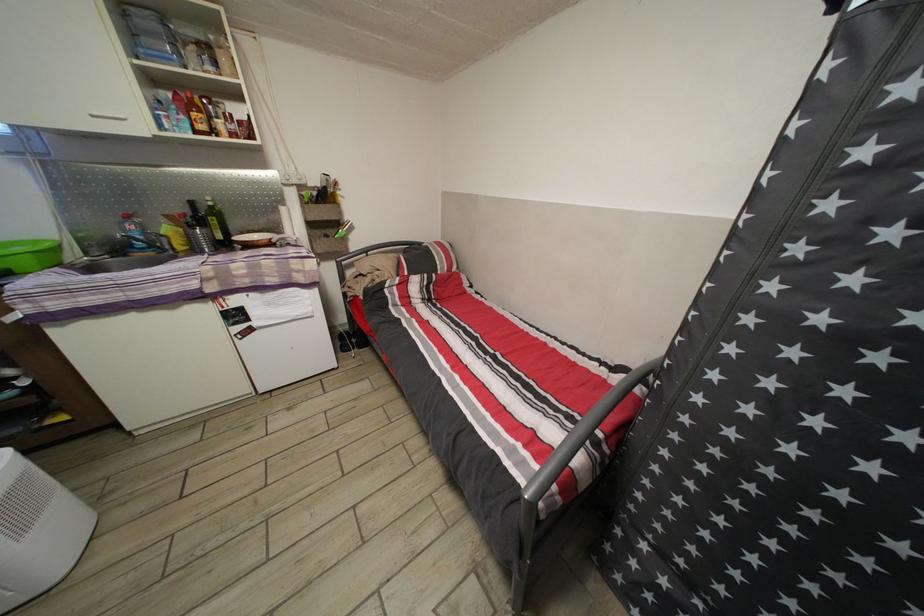
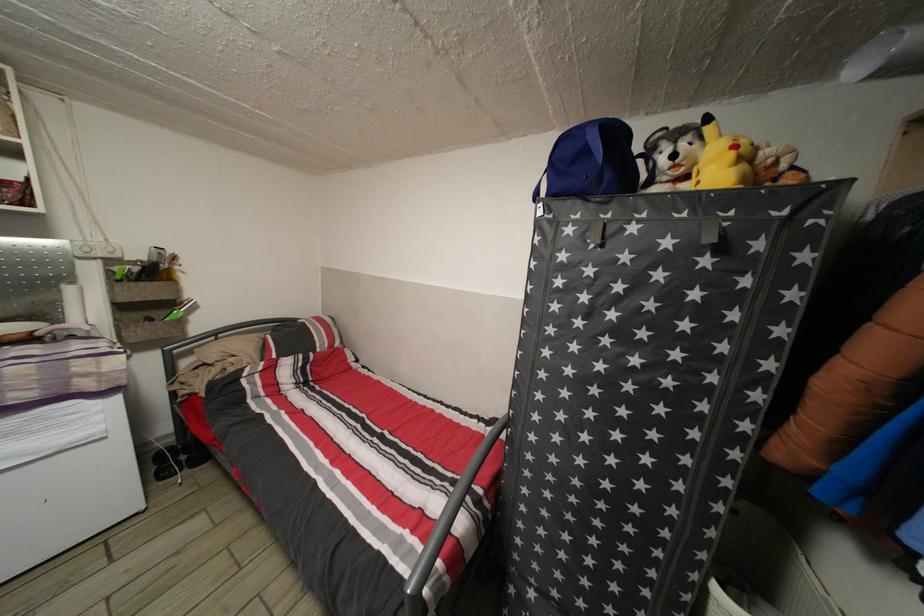
Locate, in the second image, the point that corresponds to point (318, 232) in the first image.

(128, 314)